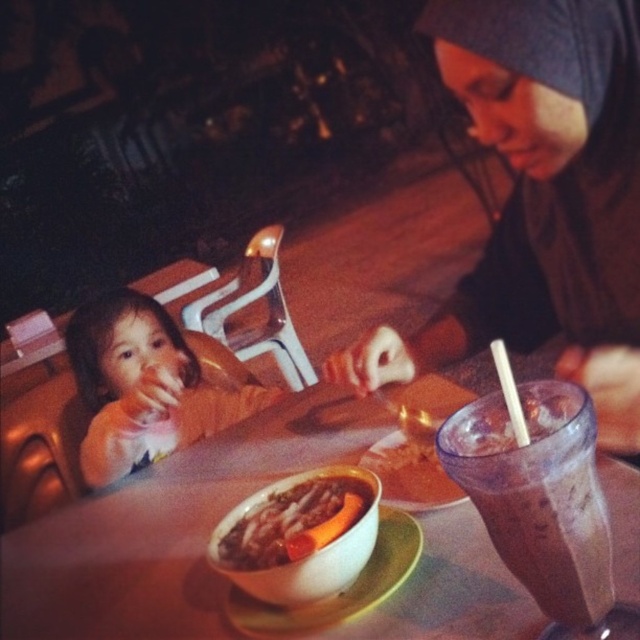
Question: Which point is farther to the camera?

Choices:
 (A) (544, 564)
 (B) (129, 433)

Answer: (B)

Question: Does smooth beige shirt at left lie in front of smooth white bowl at center?

Choices:
 (A) yes
 (B) no

Answer: (B)

Question: Can you confirm if smooth wooden table at center is bigger than chocolate milkshake at right?

Choices:
 (A) no
 (B) yes

Answer: (B)

Question: Which object is farther from the camera taking this photo?

Choices:
 (A) smooth beige shirt at left
 (B) smooth orange carrot at center
 (C) chocolate milkshake at right

Answer: (A)

Question: Is chocolate milkshake at right positioned at the back of smooth orange carrot at center?

Choices:
 (A) no
 (B) yes

Answer: (A)

Question: Which point is farther to the camera?

Choices:
 (A) smooth beige shirt at left
 (B) smooth orange carrot at center
 (C) smooth wooden table at center

Answer: (A)